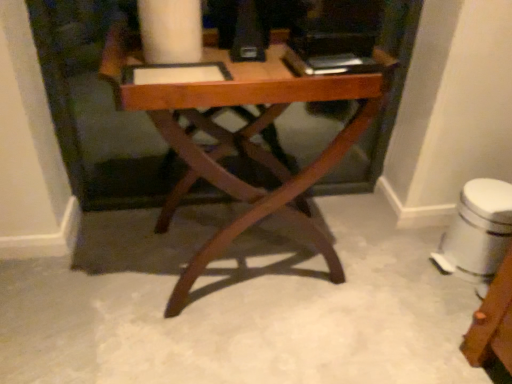
I want to click on vacant space underneath wooden table at center (from a real-world perspective), so click(233, 253).